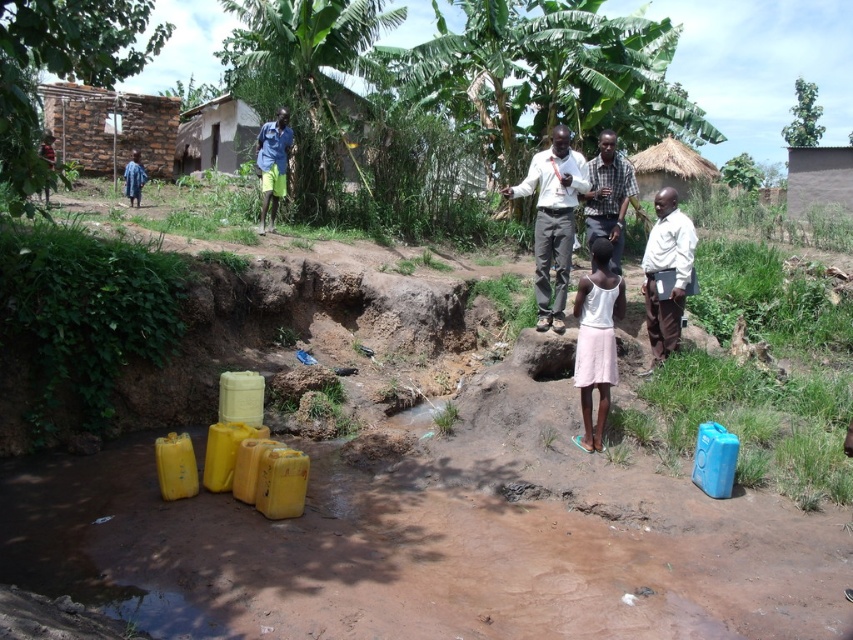
You are a photographer trying to capture a group photo of the people near the waterway. You notice two white shirts among the subjects. The first is labeled as the white shirt at center, and the second is the white matte shirt at center right. Given that you want to ensure both shirts are visible in the frame, which shirt should you position closer to the camera to avoid one being obscured by the other?

You should position the white shirt at center closer to the camera because its width is larger than the white matte shirt at center right, making it more likely to stand out and remain visible without obstruction.

You are a photographer trying to capture a group photo of the people near the waterway. You want to ensure both the white shirt at center and the checkered fabric shirt at center are clearly visible in the frame. Based on their positions, which shirt should you position closer to the left side of the camera frame to include both in the photo?

The white shirt at center is already positioned to the left of the checkered fabric shirt at center, so to include both in the photo, you should keep the white shirt at center on the left side of the frame and the checkered fabric shirt at center on the right side.

You are a photographer taking a picture of the group near the waterway. You want to ensure both the white shirt at center and the white matte shirt at center right are visible in the frame. Which shirt should you focus on to make sure the shorter one isn

The white matte shirt at center right is shorter than the white shirt at center. To ensure both are visible, focus on the white shirt at center as it is taller and will likely remain in frame even if the shorter one is partially obscured.